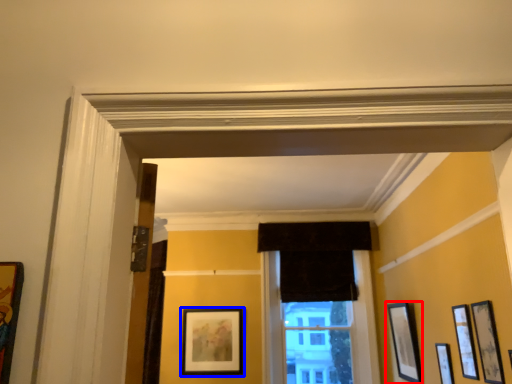
Question: Which point is further to the camera, picture frame (highlighted by a red box) or picture frame (highlighted by a blue box)?

Choices:
 (A) picture frame
 (B) picture frame

Answer: (B)